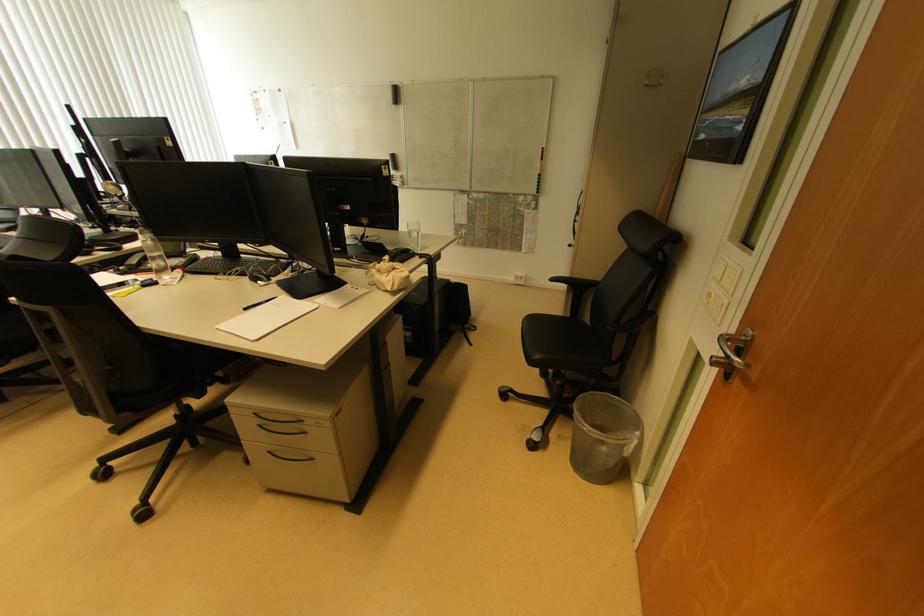
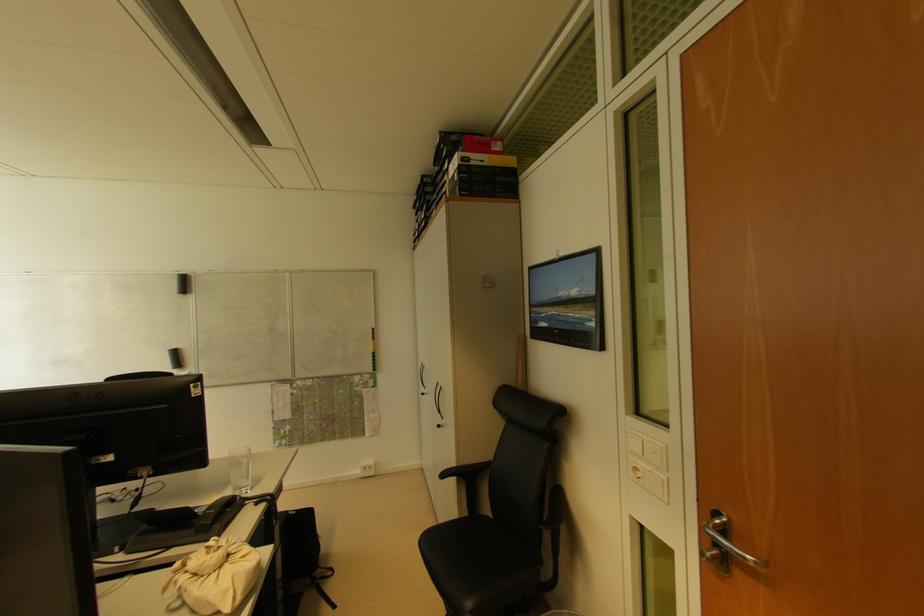
Locate, in the second image, the point that corresponds to pixel 712 297 in the first image.

(638, 471)